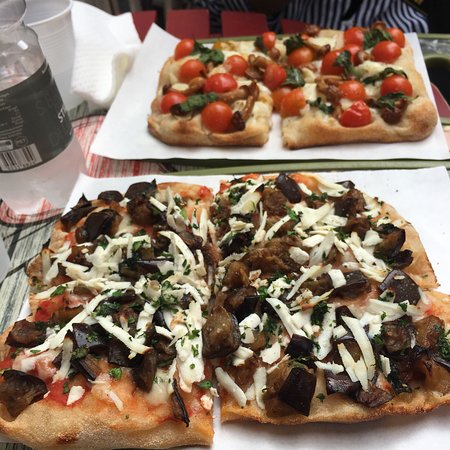
Locate an element on the screen. bottle is located at coordinates (16, 106).